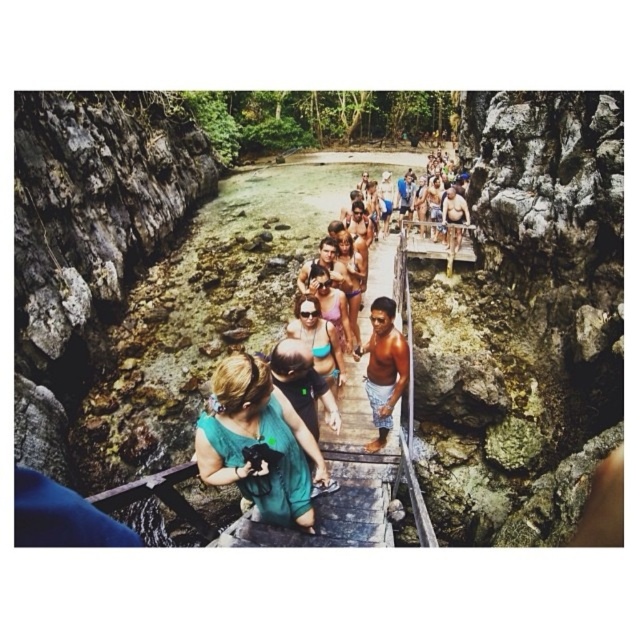
You are a photographer positioned at the center of the wooden bridge. You want to capture a photo of both the teal fabric top at center and the matte pink bikini at center. Which object should you focus on first if you want to ensure both are in sharp focus?

The teal fabric top at center is located below matte pink bikini at center, so you should focus on the matte pink bikini at center first since it is closer to the photographer. This ensures that the teal fabric top at center, being further away, will also be in focus due to depth of field principles.

You are a photographer standing on the wooden bridge and want to capture both the shiny brown shorts at center and the matte pink bikini at center in your shot. Which object should you focus on first if you want to ensure both are in the frame without moving the camera?

You should focus on the shiny brown shorts at center first because it is taller than the matte pink bikini at center, so adjusting the frame to include its height will naturally include the shorter object as well.

You are a photographer positioned on the wooden bridge and want to capture both the shiny brown shorts at center and the matte pink bikini at center in a single shot. Which object should you focus on first to ensure both are in frame?

You should focus on the shiny brown shorts at center first because it is located below the matte pink bikini at center, so adjusting the camera angle to include both would require framing from the lower part upwards.